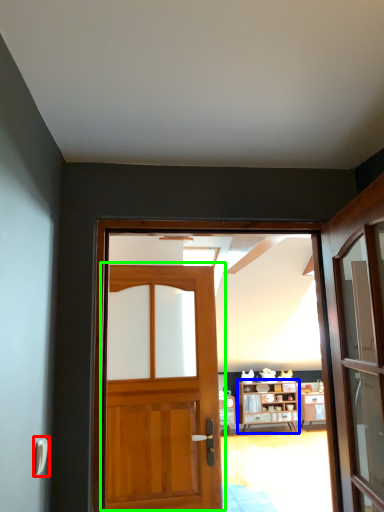
Question: Which object is the farthest from door handle (highlighted by a red box)? Choose among these: cabinetry (highlighted by a blue box) or door (highlighted by a green box).

Choices:
 (A) cabinetry
 (B) door

Answer: (A)